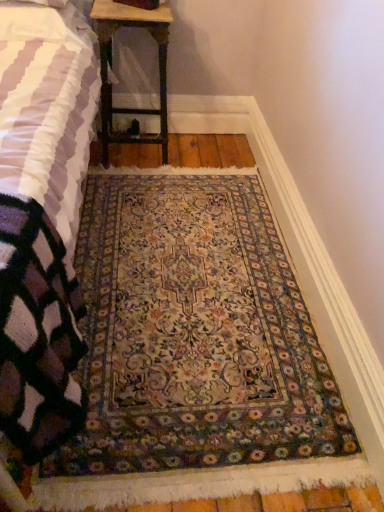
You are a GUI agent. You are given a task and a screenshot of the screen. Output one action in this format:
    pyautogui.click(x=<x>, y=<y>)
    Task: Click on the vacant space to the right of wooden table at upper center
    This screenshot has width=384, height=512.
    Given the screenshot: What is the action you would take?
    pyautogui.click(x=202, y=152)